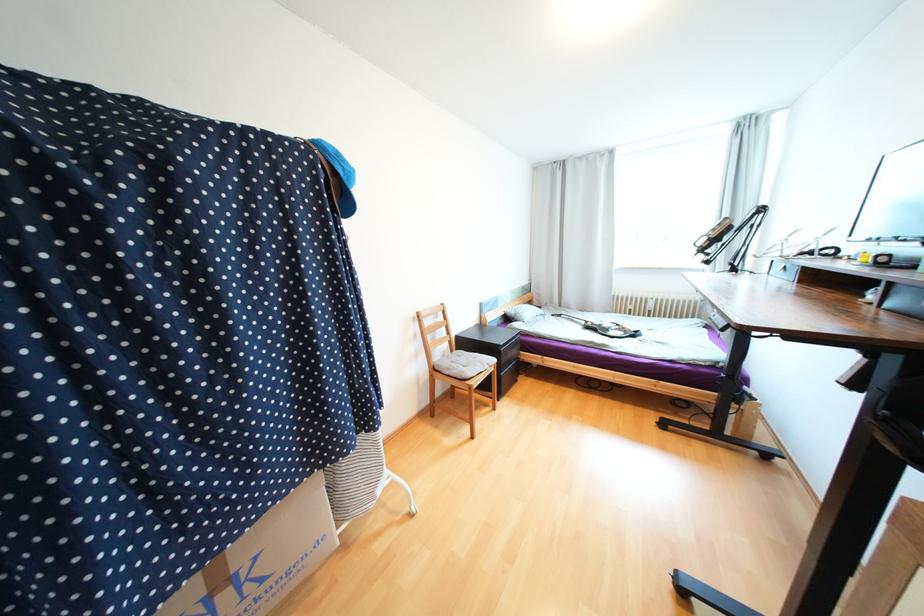
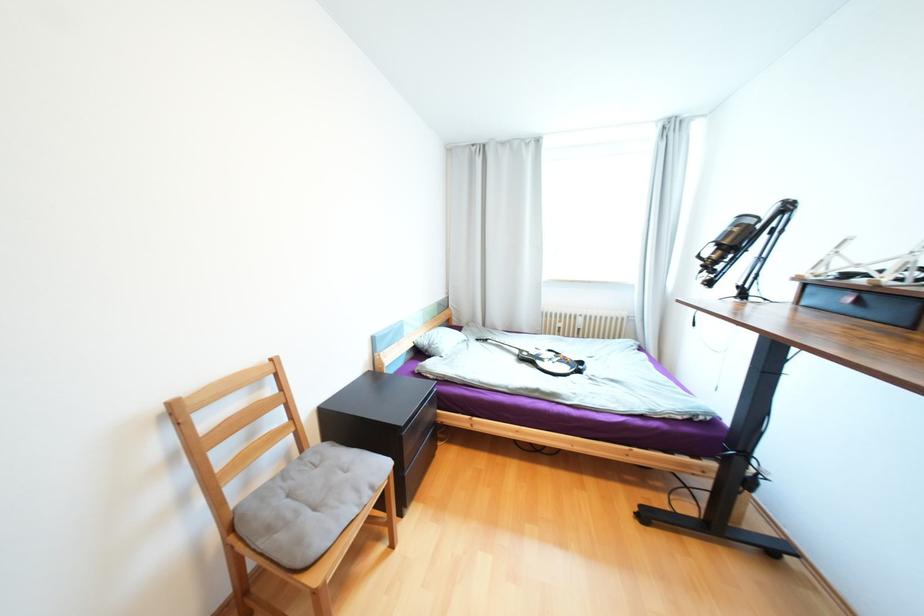
Question: How did the camera likely rotate?

Choices:
 (A) Left
 (B) Right
 (C) Up
 (D) Down

Answer: (B)